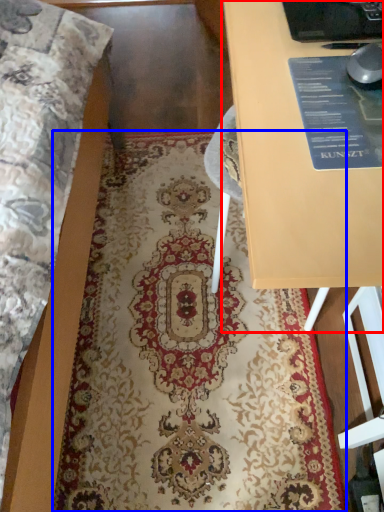
Question: Which object appears closest to the camera in this image, table (highlighted by a red box) or mat (highlighted by a blue box)?

Choices:
 (A) table
 (B) mat

Answer: (A)